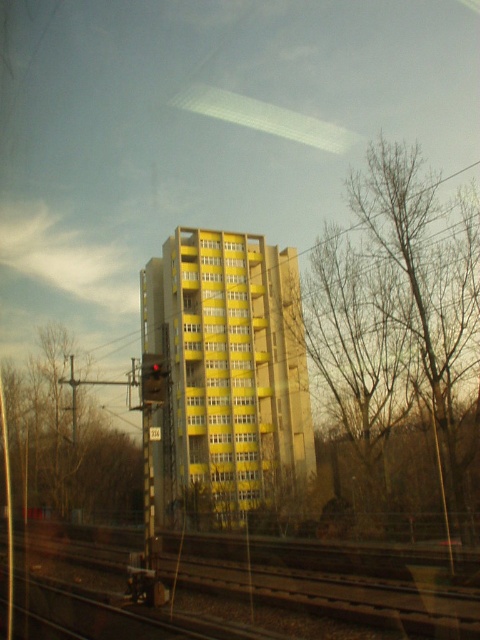
Question: Observing the image, what is the correct spatial positioning of brown gravel train track at lower left in reference to red glass traffic light at center?

Choices:
 (A) above
 (B) below

Answer: (B)

Question: Which object is positioned closest to the red glass traffic light at center?

Choices:
 (A) bare branches at left
 (B) bare wood tree at right

Answer: (B)

Question: Is brown gravel train track at lower left positioned at the back of bare branches at left?

Choices:
 (A) yes
 (B) no

Answer: (B)

Question: Considering the real-world distances, which object is closest to the brown gravel train track at lower left?

Choices:
 (A) bare wood tree at right
 (B) red glass traffic light at center

Answer: (B)

Question: Where is bare branches at left located in relation to red glass traffic light at center in the image?

Choices:
 (A) above
 (B) below

Answer: (B)

Question: Which object appears closest to the camera in this image?

Choices:
 (A) brown gravel train track at lower left
 (B) red glass traffic light at center
 (C) bare wood tree at right

Answer: (A)